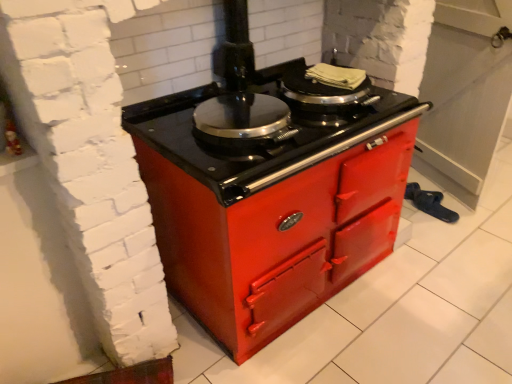
Where is `shiny metallic frying pan at center`? This screenshot has height=384, width=512. shiny metallic frying pan at center is located at coordinates (243, 121).

Describe the element at coordinates (243, 121) in the screenshot. I see `shiny metallic frying pan at center` at that location.

Measure the distance between point (203,132) and camera.

A distance of 1.48 meters exists between point (203,132) and camera.

The image size is (512, 384). I want to click on shiny metallic frying pan at center, so click(243, 121).